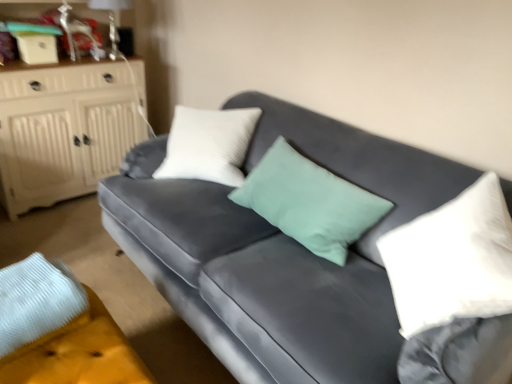
You are a GUI agent. You are given a task and a screenshot of the screen. Output one action in this format:
    pyautogui.click(x=<x>, y=<y>)
    Task: Click on the velvet gray couch at center
    This screenshot has width=512, height=384.
    Given the screenshot: What is the action you would take?
    pyautogui.click(x=282, y=254)

Where is `velvet yellow footrest at lower left`? velvet yellow footrest at lower left is located at coordinates (59, 330).

The height and width of the screenshot is (384, 512). What do you see at coordinates (452, 260) in the screenshot?
I see `white soft pillow at right` at bounding box center [452, 260].

I want to click on velvet gray couch at center, so click(282, 254).

Is point (74, 139) less distant than point (452, 279)?

No.

Considering the relative sizes of white wood cabinet at left and white soft pillow at right in the image provided, is white wood cabinet at left thinner than white soft pillow at right?

No, white wood cabinet at left is not thinner than white soft pillow at right.

From a real-world perspective, is white wood cabinet at left under white soft pillow at right?

Correct, in the physical world, white wood cabinet at left is lower than white soft pillow at right.

Considering the relative positions of white wood cabinet at left and white soft pillow at right in the image provided, is white wood cabinet at left to the left of white soft pillow at right from the viewer's perspective?

Correct, you'll find white wood cabinet at left to the left of white soft pillow at right.

Is white wood cabinet at left oriented towards velvet gray couch at center?

Yes, white wood cabinet at left is oriented towards velvet gray couch at center.

Does white wood cabinet at left have a lesser width compared to velvet gray couch at center?

Yes.

From the picture: From the image's perspective, which is below, white wood cabinet at left or velvet gray couch at center?

velvet gray couch at center appears lower in the image.

The image size is (512, 384). I want to click on footrest behind the velvet gray couch at center, so click(x=59, y=330).

From a real-world perspective, which object rests below the other?

velvet yellow footrest at lower left.

From the image's perspective, is velvet gray couch at center above or below velvet yellow footrest at lower left?

From the image's perspective, velvet gray couch at center appears above velvet yellow footrest at lower left.

Considering the relative sizes of velvet gray couch at center and velvet yellow footrest at lower left in the image provided, is velvet gray couch at center bigger than velvet yellow footrest at lower left?

Indeed, velvet gray couch at center has a larger size compared to velvet yellow footrest at lower left.

Is white soft pillow at right shorter than velvet yellow footrest at lower left?

No, white soft pillow at right is not shorter than velvet yellow footrest at lower left.

From a real-world perspective, is white soft pillow at right above or below velvet yellow footrest at lower left?

Clearly, from a real-world perspective, white soft pillow at right is above velvet yellow footrest at lower left.

Is the position of white soft pillow at right more distant than that of velvet yellow footrest at lower left?

No, white soft pillow at right is closer to the camera.

Is velvet gray couch at center situated inside white wood cabinet at left or outside?

velvet gray couch at center is spatially situated outside white wood cabinet at left.

Consider the image. From the image's perspective, which one is positioned higher, velvet gray couch at center or white wood cabinet at left?

white wood cabinet at left appears higher in the image.

From a real-world perspective, is velvet gray couch at center below white wood cabinet at left?

Yes, from a real-world perspective, velvet gray couch at center is below white wood cabinet at left.

Could you tell me if velvet gray couch at center is turned towards white wood cabinet at left?

No, velvet gray couch at center is not oriented towards white wood cabinet at left.

Between velvet gray couch at center and white soft pillow at right, which one is positioned behind?

white soft pillow at right is further away from the camera.

Measure the distance from velvet gray couch at center to white soft pillow at right.

velvet gray couch at center is 13.01 inches away from white soft pillow at right.

Which of these two, velvet gray couch at center or white soft pillow at right, is wider?

velvet gray couch at center is wider.

Considering the positions of point (197, 266) and point (480, 294), is point (197, 266) closer or farther from the camera than point (480, 294)?

Point (197, 266) is positioned farther from the camera compared to point (480, 294).

Considering the points (470, 311) and (10, 75), which point is behind, point (470, 311) or point (10, 75)?

The point (10, 75) is farther.

Based on the photo, is white soft pillow at right to the right of white wood cabinet at left from the viewer's perspective?

Yes.

This screenshot has height=384, width=512. What are the coordinates of `cabinetry behind the white soft pillow at right` in the screenshot? It's located at (66, 129).

Is white soft pillow at right positioned behind white wood cabinet at left?

No.

Find the location of a particular element. The width and height of the screenshot is (512, 384). pillow on the right of the white wood cabinet at left is located at coordinates (452, 260).

At what (x,y) coordinates should I click in order to perform the action: click on cabinetry behind the velvet gray couch at center. Please return your answer as a coordinate pair (x, y). Looking at the image, I should click on (66, 129).

Considering their positions, is white wood cabinet at left positioned further to velvet yellow footrest at lower left than white soft pillow at right?

white wood cabinet at left.

From the image, which object appears to be nearer to white soft pillow at right, velvet yellow footrest at lower left or velvet gray couch at center?

velvet gray couch at center lies closer to white soft pillow at right than the other object.

Based on their spatial positions, is white soft pillow at right or white wood cabinet at left further from velvet yellow footrest at lower left?

white wood cabinet at left is further to velvet yellow footrest at lower left.

Considering their positions, is white wood cabinet at left positioned closer to white soft pillow at right than velvet gray couch at center?

velvet gray couch at center is positioned closer to the anchor white soft pillow at right.

Which object lies nearer to the anchor point white soft pillow at right, white wood cabinet at left or velvet yellow footrest at lower left?

velvet yellow footrest at lower left is positioned closer to the anchor white soft pillow at right.

Based on their spatial positions, is white soft pillow at right or white wood cabinet at left closer to velvet gray couch at center?

Among the two, white soft pillow at right is located nearer to velvet gray couch at center.

When comparing their distances from white wood cabinet at left, does velvet yellow footrest at lower left or white soft pillow at right seem further?

The object further to white wood cabinet at left is white soft pillow at right.

Estimate the real-world distances between objects in this image. Which object is further from velvet yellow footrest at lower left, velvet gray couch at center or white wood cabinet at left?

Based on the image, white wood cabinet at left appears to be further to velvet yellow footrest at lower left.

The height and width of the screenshot is (384, 512). I want to click on studio couch between velvet yellow footrest at lower left and white soft pillow at right, so click(x=282, y=254).

Image resolution: width=512 pixels, height=384 pixels. I want to click on footrest between white wood cabinet at left and velvet gray couch at center from left to right, so click(x=59, y=330).

Where is `studio couch between white wood cabinet at left and white soft pillow at right from left to right`? studio couch between white wood cabinet at left and white soft pillow at right from left to right is located at coordinates click(x=282, y=254).

Locate an element on the screen. This screenshot has width=512, height=384. the footrest located between white wood cabinet at left and white soft pillow at right in the left-right direction is located at coordinates (59, 330).